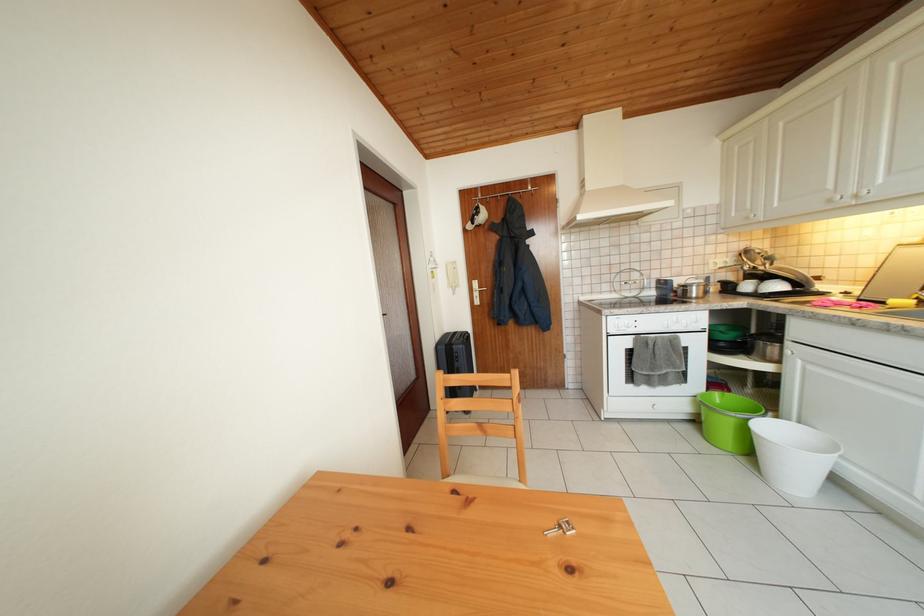
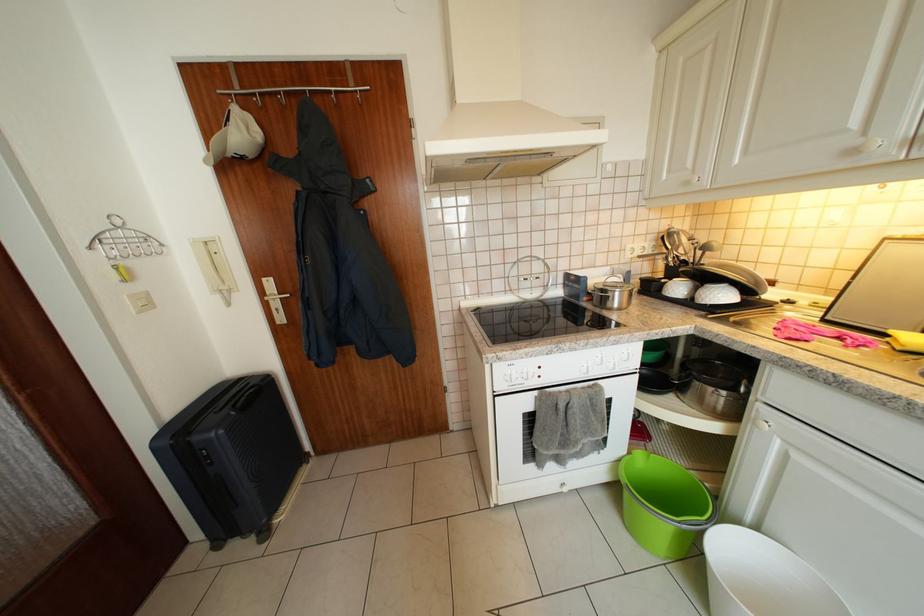
Find the pixel in the second image that matches the point at 702,294 in the first image.

(626, 299)